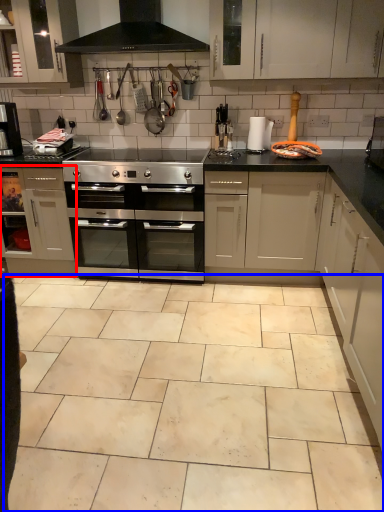
Question: Which object is closer to the camera taking this photo, cabinetry (highlighted by a red box) or ceramic tile (highlighted by a blue box)?

Choices:
 (A) cabinetry
 (B) ceramic tile

Answer: (B)